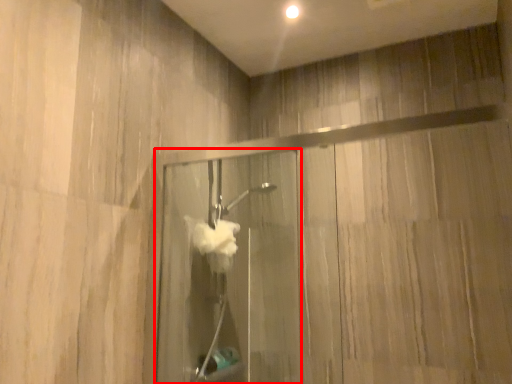
Question: Where is screen door (annotated by the red box) located in relation to glass door in the image?

Choices:
 (A) right
 (B) left

Answer: (B)